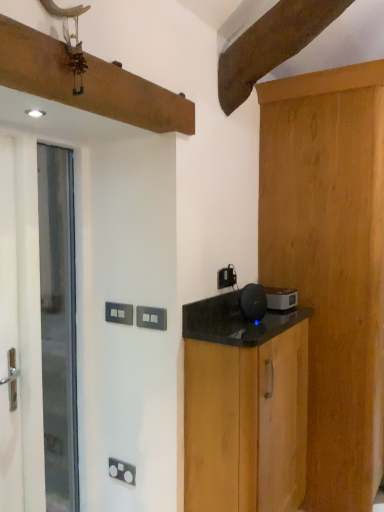
Identify the location of vacant space that is to the left of black plastic speaker at center, the second appliance from the right. This screenshot has height=512, width=384. (213, 326).